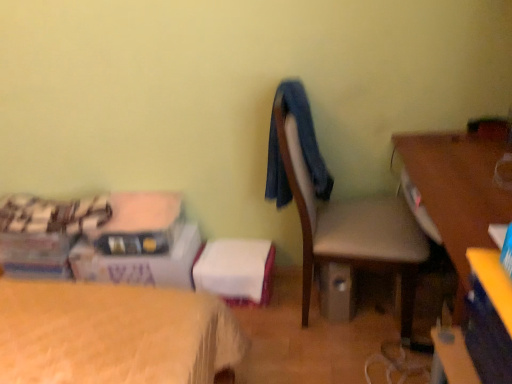
This screenshot has height=384, width=512. Identify the location of free point above wooden desk at right (from a real-world perspective). (470, 175).